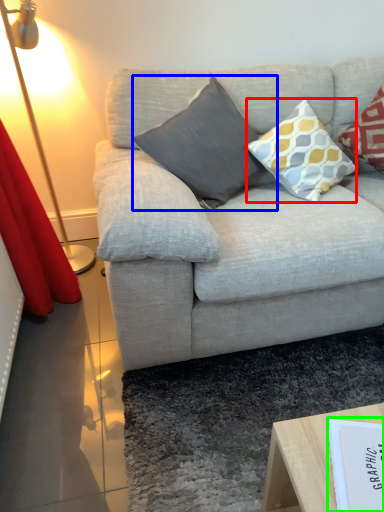
Question: Which object is the closest to the pillow (highlighted by a red box)? Choose among these: pillow (highlighted by a blue box) or paperback book (highlighted by a green box).

Choices:
 (A) pillow
 (B) paperback book

Answer: (A)